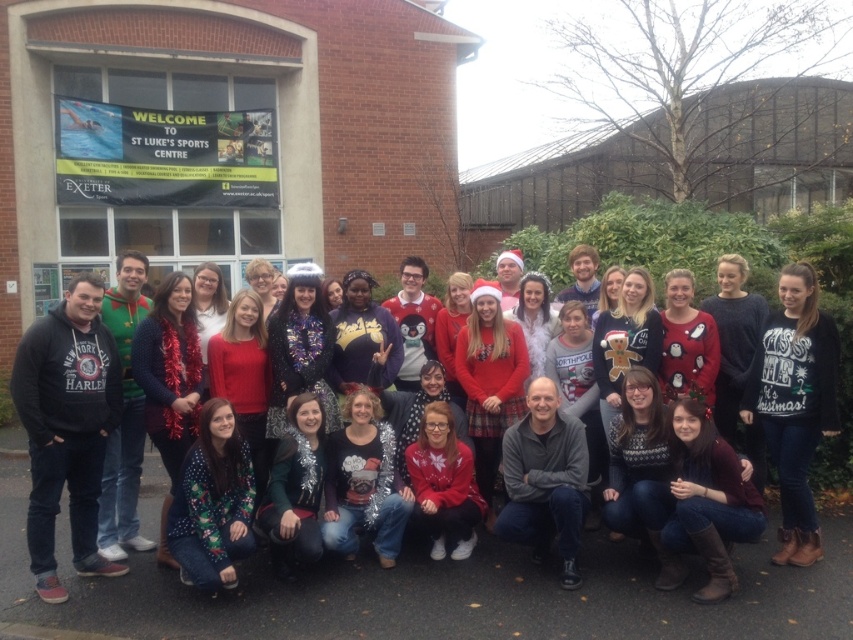
Question: Is white sweater at center further to camera compared to brown leather boots at lower right?

Choices:
 (A) yes
 (B) no

Answer: (A)

Question: Does white sweater at center lie in front of brown leather boots at lower right?

Choices:
 (A) no
 (B) yes

Answer: (A)

Question: Among these points, which one is nearest to the camera?

Choices:
 (A) (689, 404)
 (B) (799, 412)

Answer: (A)

Question: Is white sweater at center thinner than brown leather boots at lower right?

Choices:
 (A) yes
 (B) no

Answer: (A)

Question: Which of the following is the closest to the observer?

Choices:
 (A) brown leather boots at lower right
 (B) white sweater at center

Answer: (A)